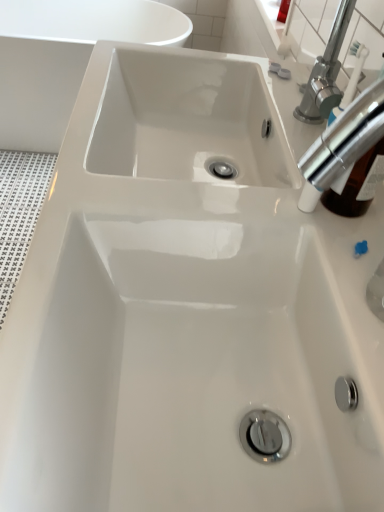
Question: From a real-world perspective, is white glossy bathtub at upper left above or below chrome metallic tap at upper right?

Choices:
 (A) above
 (B) below

Answer: (B)

Question: From the image's perspective, relative to chrome metallic tap at upper right, is white glossy bathtub at upper left above or below?

Choices:
 (A) above
 (B) below

Answer: (A)

Question: Is white glossy bathtub at upper left in front of or behind chrome metallic tap at upper right in the image?

Choices:
 (A) front
 (B) behind

Answer: (B)

Question: Considering the positions of point (362, 147) and point (41, 64), is point (362, 147) closer or farther from the camera than point (41, 64)?

Choices:
 (A) farther
 (B) closer

Answer: (B)

Question: From the image's perspective, is chrome metallic tap at upper right positioned above or below white glossy bathtub at upper left?

Choices:
 (A) below
 (B) above

Answer: (A)

Question: Choose the correct answer: Is chrome metallic tap at upper right inside white glossy bathtub at upper left or outside it?

Choices:
 (A) inside
 (B) outside

Answer: (B)

Question: From a real-world perspective, is chrome metallic tap at upper right positioned above or below white glossy bathtub at upper left?

Choices:
 (A) above
 (B) below

Answer: (A)